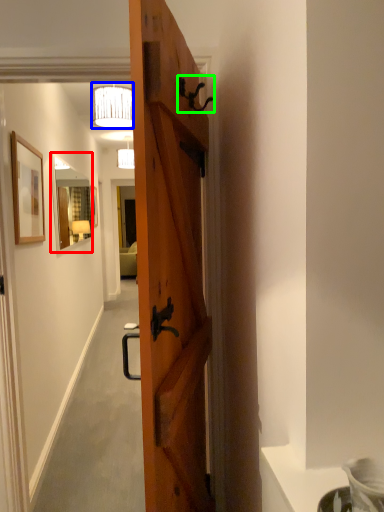
Question: Which is farther away from mirror (highlighted by a red box)? lamp (highlighted by a blue box) or door handle (highlighted by a green box)?

Choices:
 (A) lamp
 (B) door handle

Answer: (B)